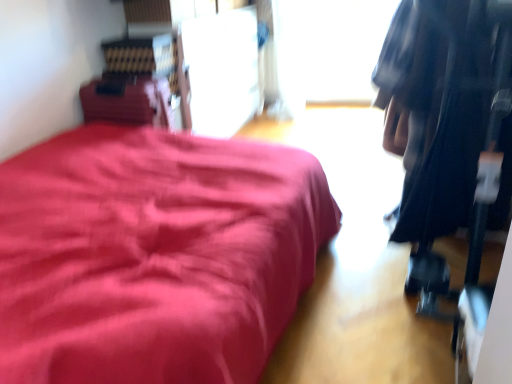
Question: Is matte red bed at left completely or partially outside of transparent glass window at upper center?

Choices:
 (A) no
 (B) yes

Answer: (B)

Question: Can you confirm if matte red bed at left is taller than transparent glass window at upper center?

Choices:
 (A) yes
 (B) no

Answer: (B)

Question: Does matte red bed at left have a larger size compared to transparent glass window at upper center?

Choices:
 (A) yes
 (B) no

Answer: (A)

Question: From a real-world perspective, is matte red bed at left located higher than transparent glass window at upper center?

Choices:
 (A) no
 (B) yes

Answer: (A)

Question: Does matte red bed at left have a lesser width compared to transparent glass window at upper center?

Choices:
 (A) no
 (B) yes

Answer: (A)

Question: Is point (10, 297) closer or farther from the camera than point (440, 114)?

Choices:
 (A) farther
 (B) closer

Answer: (B)

Question: Looking at their shapes, would you say matte red bed at left is wider or thinner than black fabric bag at right?

Choices:
 (A) thin
 (B) wide

Answer: (B)

Question: Is matte red bed at left inside the boundaries of black fabric bag at right, or outside?

Choices:
 (A) outside
 (B) inside

Answer: (A)

Question: Relative to black fabric bag at right, is matte red bed at left in front or behind?

Choices:
 (A) front
 (B) behind

Answer: (A)

Question: From a real-world perspective, is black fabric bag at right physically located above or below transparent glass window at upper center?

Choices:
 (A) above
 (B) below

Answer: (A)

Question: From the image's perspective, is black fabric bag at right located above or below transparent glass window at upper center?

Choices:
 (A) below
 (B) above

Answer: (A)

Question: Considering their positions, is black fabric bag at right located in front of or behind transparent glass window at upper center?

Choices:
 (A) front
 (B) behind

Answer: (A)

Question: Does point (478, 23) appear closer or farther from the camera than point (278, 71)?

Choices:
 (A) closer
 (B) farther

Answer: (A)

Question: From the image's perspective, is black fabric bag at right above or below matte red bed at left?

Choices:
 (A) below
 (B) above

Answer: (B)

Question: In terms of size, does black fabric bag at right appear bigger or smaller than matte red bed at left?

Choices:
 (A) small
 (B) big

Answer: (B)